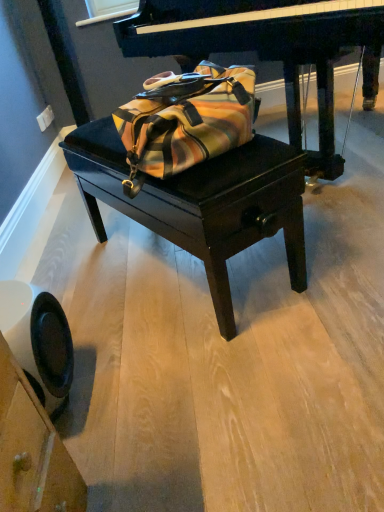
Where is `free space between velvet black table at center and black plastic swivel chair at lower left`? Image resolution: width=384 pixels, height=512 pixels. free space between velvet black table at center and black plastic swivel chair at lower left is located at coordinates (119, 322).